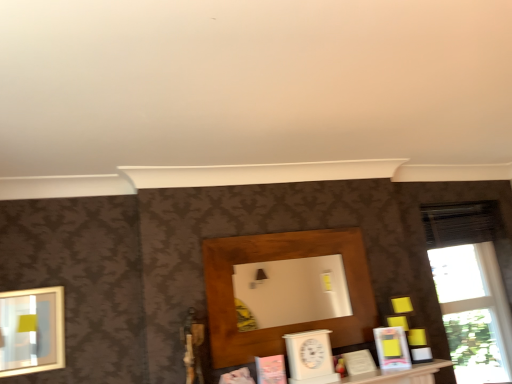
Question: Considering the relative sizes of wooden shelf at center and matte pink book at center, the fourth book positioned from the right, in the image provided, is wooden shelf at center thinner than matte pink book at center, the fourth book positioned from the right,?

Choices:
 (A) no
 (B) yes

Answer: (B)

Question: From the image's perspective, is wooden shelf at center below matte pink book at center, acting as the 1th book starting from the left?

Choices:
 (A) yes
 (B) no

Answer: (B)

Question: Does wooden shelf at center have a smaller size compared to matte pink book at center, acting as the 1th book starting from the left?

Choices:
 (A) no
 (B) yes

Answer: (A)

Question: Does wooden shelf at center lie behind matte pink book at center, the fourth book positioned from the right?

Choices:
 (A) yes
 (B) no

Answer: (A)

Question: Is wooden shelf at center to the right of matte pink book at center, acting as the 1th book starting from the left, from the viewer's perspective?

Choices:
 (A) yes
 (B) no

Answer: (A)

Question: Considering the positions of white matte book at center, the second book in the right-to-left sequence, and transparent glass window at right in the image, is white matte book at center, the second book in the right-to-left sequence, taller or shorter than transparent glass window at right?

Choices:
 (A) short
 (B) tall

Answer: (A)

Question: Would you say white matte book at center, which appears as the 3th book when viewed from the left, is to the left or to the right of transparent glass window at right in the picture?

Choices:
 (A) left
 (B) right

Answer: (A)

Question: From the image's perspective, is white matte book at center, which appears as the 3th book when viewed from the left, positioned above or below transparent glass window at right?

Choices:
 (A) above
 (B) below

Answer: (B)

Question: Relative to transparent glass window at right, is white matte book at center, which appears as the 3th book when viewed from the left, in front or behind?

Choices:
 (A) front
 (B) behind

Answer: (A)

Question: From a real-world perspective, is wooden shelf at center above or below matte gold picture frame at left?

Choices:
 (A) above
 (B) below

Answer: (A)

Question: Is wooden shelf at center inside or outside of matte gold picture frame at left?

Choices:
 (A) inside
 (B) outside

Answer: (B)

Question: From the image's perspective, is wooden shelf at center above or below matte gold picture frame at left?

Choices:
 (A) above
 (B) below

Answer: (A)

Question: Considering the positions of point tap(372, 337) and point tap(3, 311), is point tap(372, 337) closer or farther from the camera than point tap(3, 311)?

Choices:
 (A) closer
 (B) farther

Answer: (B)

Question: From a real-world perspective, is matte pink book at center, acting as the 1th book starting from the left, above or below transparent glass window at right?

Choices:
 (A) below
 (B) above

Answer: (A)

Question: Is matte pink book at center, the fourth book positioned from the right, bigger or smaller than transparent glass window at right?

Choices:
 (A) big
 (B) small

Answer: (B)